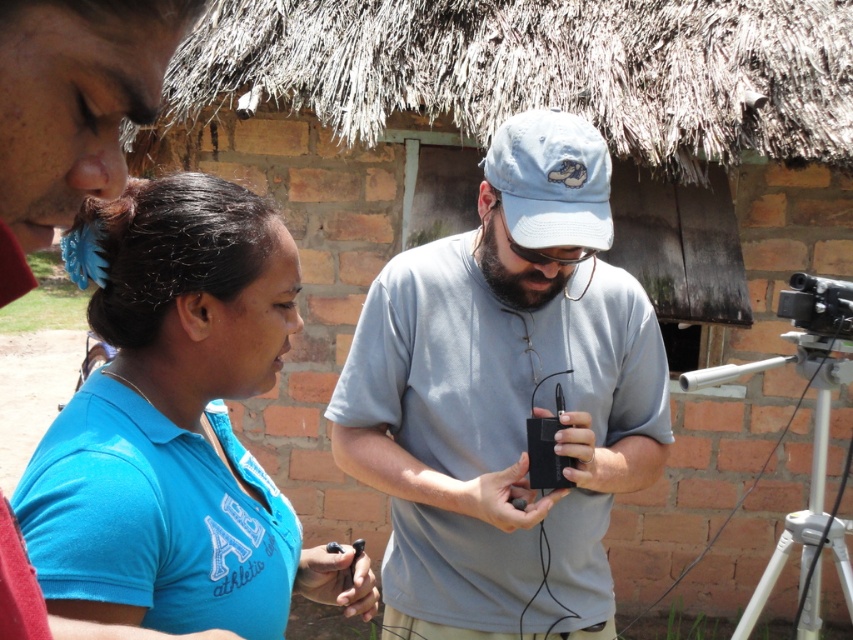
Does black matte speaker at center appear under white plastic tripod at lower right?

No, black matte speaker at center is not below white plastic tripod at lower right.

Is black matte speaker at center taller than white plastic tripod at lower right?

Yes, black matte speaker at center is taller than white plastic tripod at lower right.

Which is behind, point (622, 312) or point (755, 611)?

Point (755, 611)

Where is `black matte speaker at center`? The height and width of the screenshot is (640, 853). black matte speaker at center is located at coordinates (506, 397).

Is point (556, 188) positioned after point (824, 353)?

No.

Can you confirm if light blue fabric baseball cap at center is taller than white plastic tripod at lower right?

No, light blue fabric baseball cap at center is not taller than white plastic tripod at lower right.

Does point (567, 132) come farther from viewer compared to point (840, 531)?

No, it is in front of (840, 531).

You are a GUI agent. You are given a task and a screenshot of the screen. Output one action in this format:
    pyautogui.click(x=<x>, y=<y>)
    Task: Click on the light blue fabric baseball cap at center
    Image resolution: width=853 pixels, height=640 pixels.
    Given the screenshot: What is the action you would take?
    pos(550,180)

Does black matte speaker at center appear over light blue fabric baseball cap at center?

No, black matte speaker at center is not above light blue fabric baseball cap at center.

Which is below, black matte speaker at center or light blue fabric baseball cap at center?

black matte speaker at center

This screenshot has height=640, width=853. What are the coordinates of `black matte speaker at center` in the screenshot? It's located at (506, 397).

I want to click on black matte speaker at center, so click(x=506, y=397).